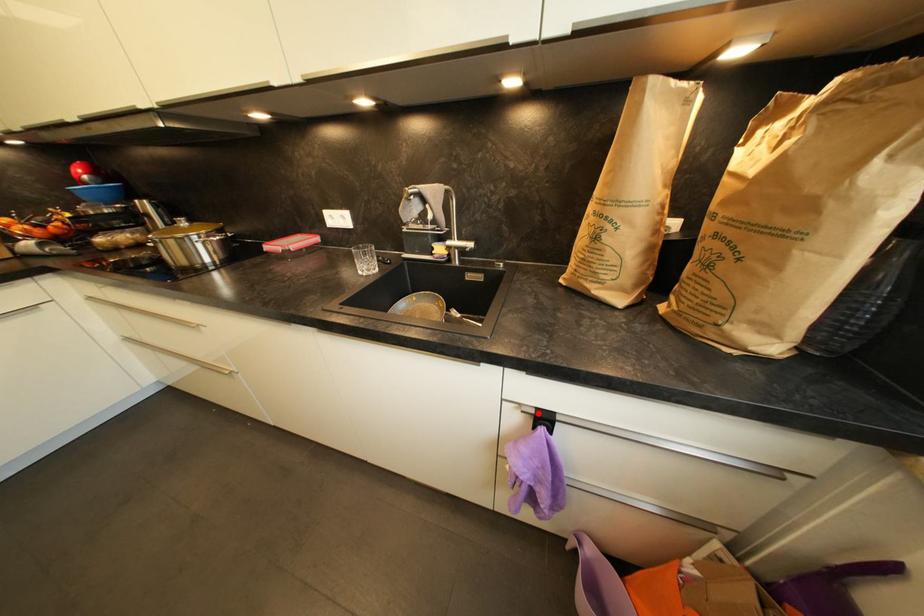
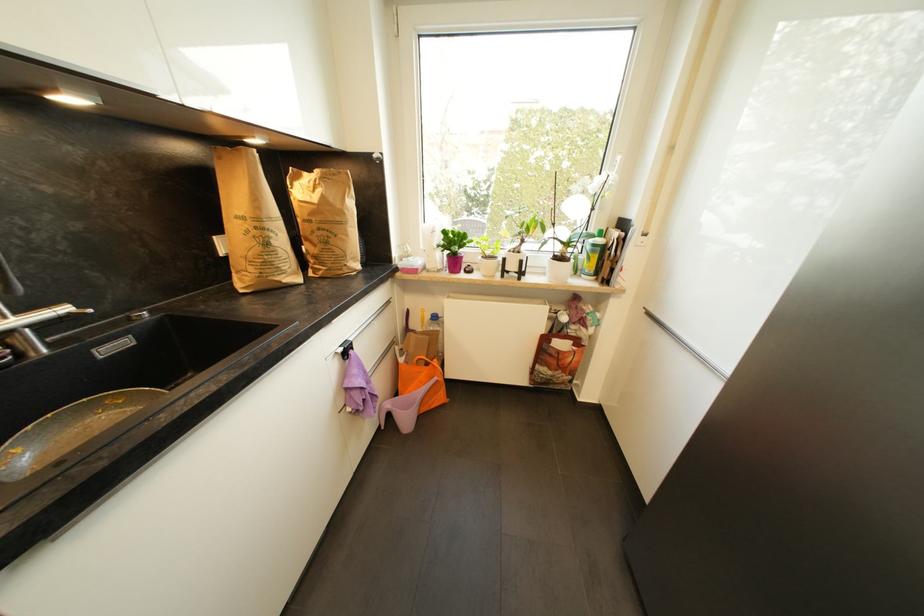
Question: I am providing you with two images of the same scene from different viewpoints. In image1, a red point is highlighted. Considering the same 3D point in image2, which of the following is correct?

Choices:
 (A) It is closer
 (B) It is farther

Answer: (A)